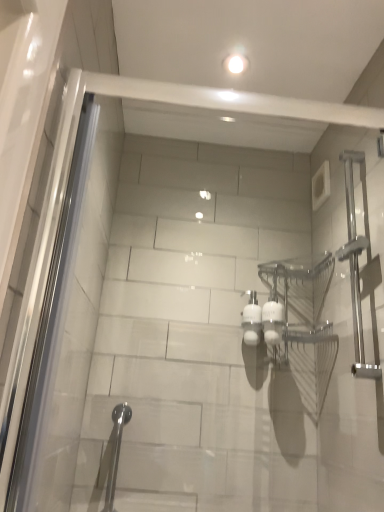
Question: From a real-world perspective, is satin nickel towel bar at right, the 2th shower ordered from the bottom, on top of satin nickel shower at lower left, placed as the 1th shower when sorted from left to right?

Choices:
 (A) no
 (B) yes

Answer: (B)

Question: Is satin nickel towel bar at right, which is the second shower from left to right, far away from satin nickel shower at lower left, which is counted as the second shower, starting from the right?

Choices:
 (A) yes
 (B) no

Answer: (B)

Question: Is satin nickel towel bar at right, which is the 1th shower from right to left, closer to the viewer compared to satin nickel shower at lower left, the 1th shower positioned from the bottom?

Choices:
 (A) no
 (B) yes

Answer: (B)

Question: Is satin nickel towel bar at right, which is the 1th shower from right to left, looking in the opposite direction of satin nickel shower at lower left, which is counted as the second shower, starting from the top?

Choices:
 (A) no
 (B) yes

Answer: (A)

Question: Can you confirm if satin nickel towel bar at right, the 1th shower when ordered from top to bottom, is bigger than satin nickel shower at lower left, placed as the 1th shower when sorted from left to right?

Choices:
 (A) yes
 (B) no

Answer: (A)

Question: From the image's perspective, is satin nickel towel bar at right, which is the second shower from left to right, on satin nickel shower at lower left, which is counted as the second shower, starting from the right?

Choices:
 (A) yes
 (B) no

Answer: (A)

Question: Is satin nickel shower at lower left, which is counted as the second shower, starting from the top, taller than satin nickel towel bar at right, the 2th shower ordered from the bottom?

Choices:
 (A) no
 (B) yes

Answer: (A)

Question: From the image's perspective, is satin nickel shower at lower left, the 1th shower positioned from the bottom, on top of satin nickel towel bar at right, which is the second shower from left to right?

Choices:
 (A) yes
 (B) no

Answer: (B)

Question: Considering the relative positions of satin nickel shower at lower left, placed as the 1th shower when sorted from left to right, and satin nickel towel bar at right, the 1th shower when ordered from top to bottom, in the image provided, is satin nickel shower at lower left, placed as the 1th shower when sorted from left to right, to the right of satin nickel towel bar at right, the 1th shower when ordered from top to bottom, from the viewer's perspective?

Choices:
 (A) no
 (B) yes

Answer: (A)

Question: Is satin nickel shower at lower left, the 1th shower positioned from the bottom, to the left of satin nickel towel bar at right, the 1th shower when ordered from top to bottom, from the viewer's perspective?

Choices:
 (A) yes
 (B) no

Answer: (A)

Question: Is satin nickel shower at lower left, which is counted as the second shower, starting from the top, bigger than satin nickel towel bar at right, which is the 1th shower from right to left?

Choices:
 (A) yes
 (B) no

Answer: (B)

Question: Is satin nickel shower at lower left, which is counted as the second shower, starting from the top, positioned before satin nickel towel bar at right, which is the 1th shower from right to left?

Choices:
 (A) yes
 (B) no

Answer: (B)

Question: From a real-world perspective, is satin nickel towel bar at right, which is the second shower from left to right, physically located above or below satin nickel shower at lower left, the 1th shower positioned from the bottom?

Choices:
 (A) below
 (B) above

Answer: (B)